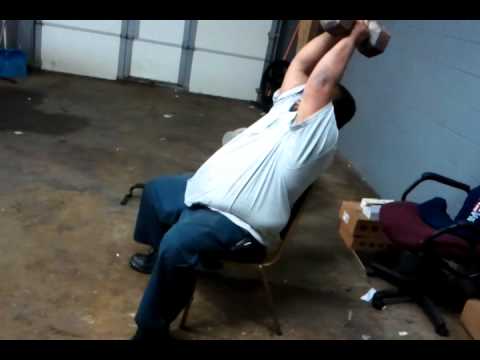
In order to click on floor in this screenshot , I will do `click(87, 190)`.